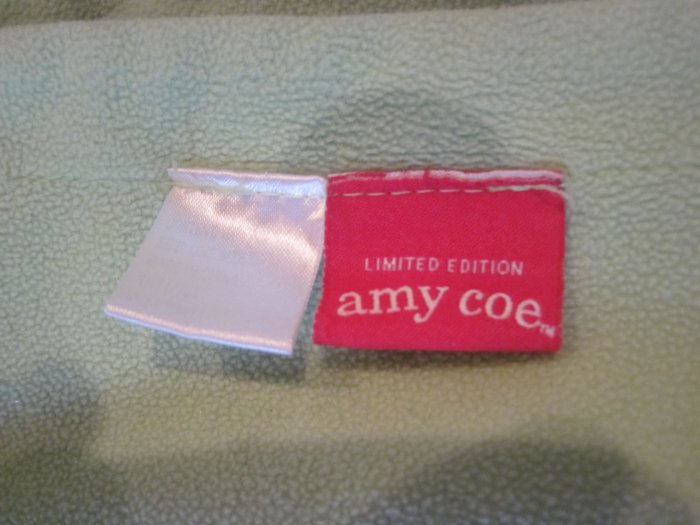
Where is `blanket`? This screenshot has height=525, width=700. blanket is located at coordinates (131, 113).